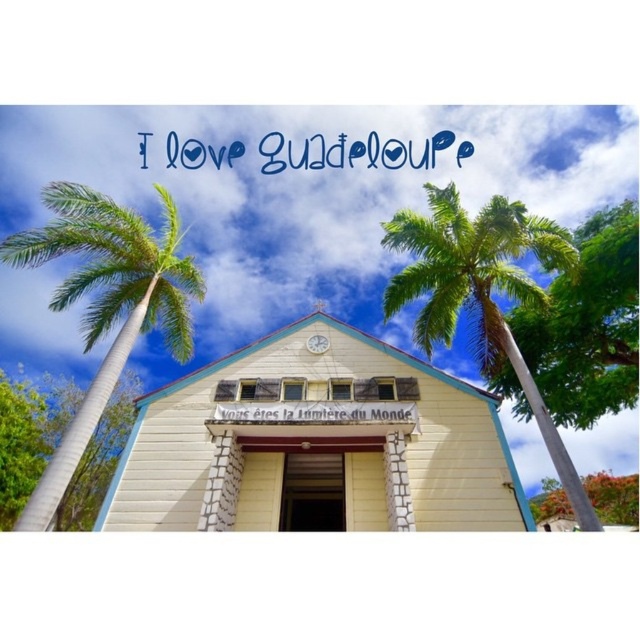
Between point (513, 490) and point (426, 316), which one is positioned in front?

Point (513, 490)

Identify the location of white wood chapel at center. (316, 442).

At what (x,y) coordinates should I click in order to perform the action: click on white wood chapel at center. Please return your answer as a coordinate pair (x, y). This screenshot has height=640, width=640. Looking at the image, I should click on (316, 442).

Find the location of a particular element. This screenshot has height=640, width=640. white wood chapel at center is located at coordinates (316, 442).

Does white wood chapel at center lie behind green leafy palm tree at left?

Yes.

Which of these two, white wood chapel at center or green leafy palm tree at left, stands taller?

green leafy palm tree at left is taller.

Locate an element on the screen. Image resolution: width=640 pixels, height=640 pixels. white wood chapel at center is located at coordinates (316, 442).

How distant is green leafy palm tree at left from green leafy palm tree at center?

green leafy palm tree at left and green leafy palm tree at center are 13.22 meters apart from each other.

Can you confirm if green leafy palm tree at left is bigger than green leafy palm tree at center?

Indeed, green leafy palm tree at left has a larger size compared to green leafy palm tree at center.

Is point (61, 301) positioned after point (444, 198)?

That is True.

In order to click on green leafy palm tree at left in this screenshot , I will do `click(106, 304)`.